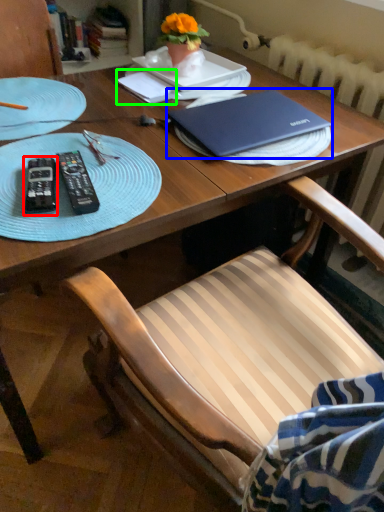
Question: Estimate the real-world distances between objects in this image. Which object is closer to remote control (highlighted by a red box), laptop (highlighted by a blue box) or notepad (highlighted by a green box)?

Choices:
 (A) laptop
 (B) notepad

Answer: (A)